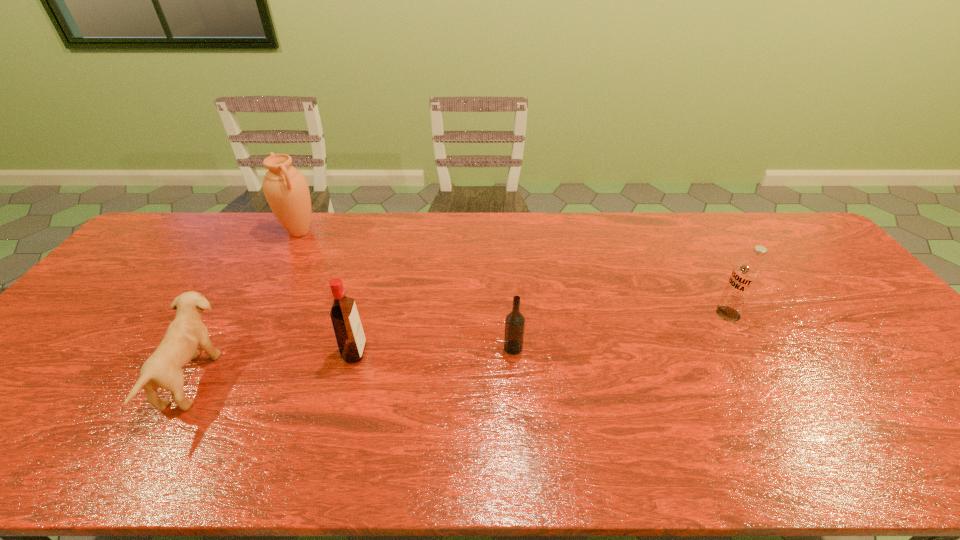
You are a GUI agent. You are given a task and a screenshot of the screen. Output one action in this format:
    pyautogui.click(x=<x>, y=<y>)
    Task: Click on the free space between the leftmost vodka and the puppy
    The width and height of the screenshot is (960, 540).
    Given the screenshot: What is the action you would take?
    pyautogui.click(x=274, y=366)

Image resolution: width=960 pixels, height=540 pixels. I want to click on free point between the urn and the leftmost vodka, so click(x=327, y=292).

Identify the location of object that is the third nearest to the third object from left to right. The image size is (960, 540). (286, 190).

Select which object appears as the closest to the fourth object from left to right. Please provide its 2D coordinates. Your answer should be formatted as a tuple, i.e. [(x, y)], where the tuple contains the x and y coordinates of a point satisfying the conditions above.

[(348, 329)]

At what (x,y) coordinates should I click in order to perform the action: click on vodka object that ranks as the second closest to the second vodka from right to left. Please return your answer as a coordinate pair (x, y). Looking at the image, I should click on (746, 277).

Find the location of a particular element. Image resolution: width=960 pixels, height=540 pixels. the second closest vodka relative to the third object from left to right is located at coordinates (746, 277).

Find the location of a particular element. vacant point that satisfies the following two spatial constraints: 1. on the front side of the urn; 2. on the left side of the puppy is located at coordinates (222, 379).

At what (x,y) coordinates should I click in order to perform the action: click on vacant space that satisfies the following two spatial constraints: 1. on the front label of the rightmost object; 2. on the front side of the second vodka from right to left. Please return your answer as a coordinate pair (x, y). This screenshot has height=540, width=960. Looking at the image, I should click on (748, 348).